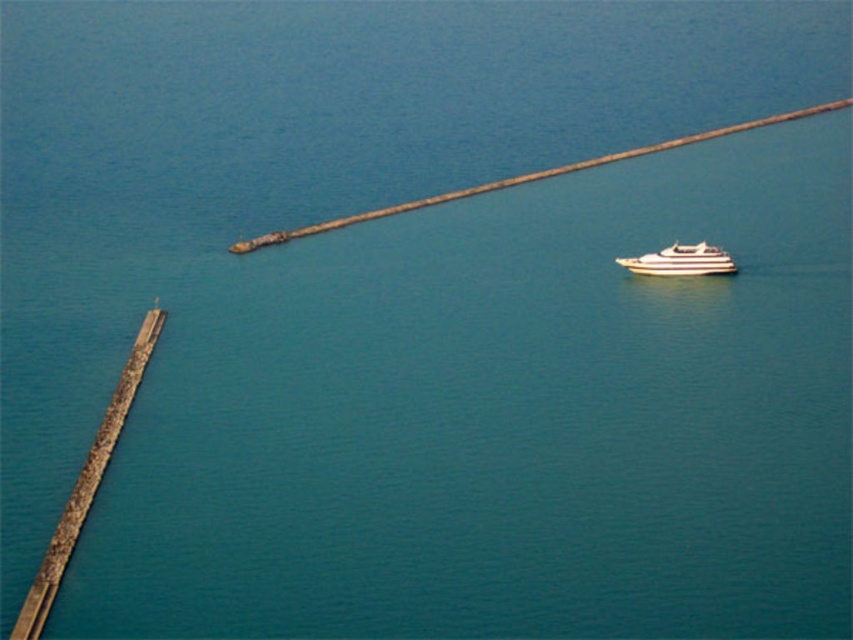
You are standing on the gray concrete pier at left and want to reach the white striped boat at right. Which direction should you move to get there?

The gray concrete pier at left is positioned on the left side of the white striped boat at right, so you should move to the right to reach it.